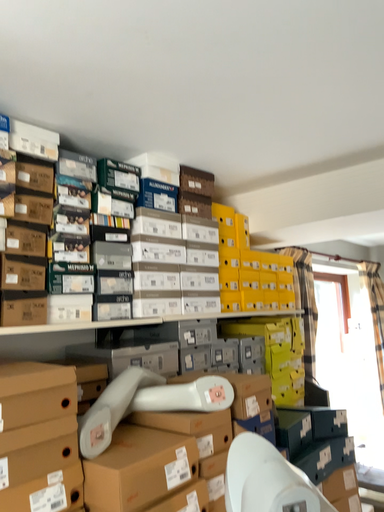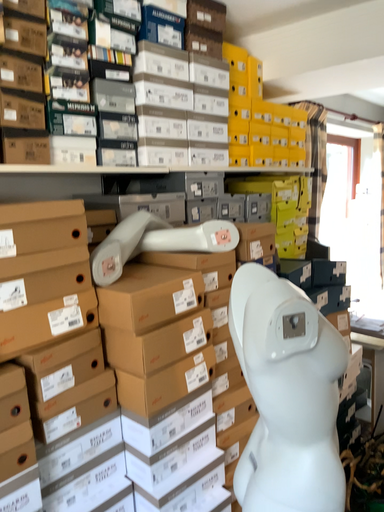
Question: Which way did the camera rotate in the video?

Choices:
 (A) rotated upward
 (B) rotated downward

Answer: (B)